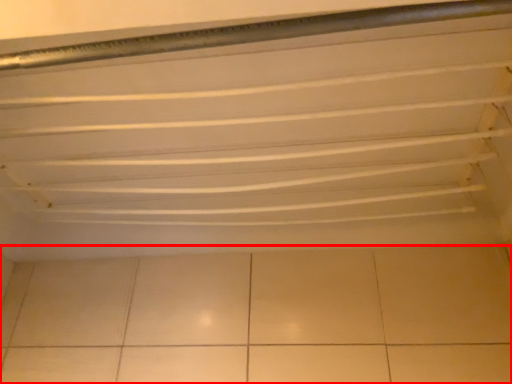
Question: In this image, where is ceramic tile (annotated by the red box) located relative to shelf?

Choices:
 (A) left
 (B) right

Answer: (B)